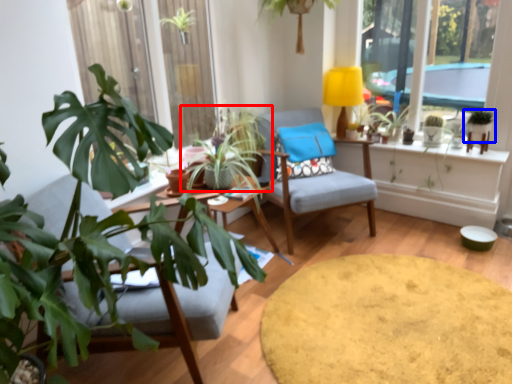
Question: Which object is closer to the camera taking this photo, houseplant (highlighted by a red box) or houseplant (highlighted by a blue box)?

Choices:
 (A) houseplant
 (B) houseplant

Answer: (B)